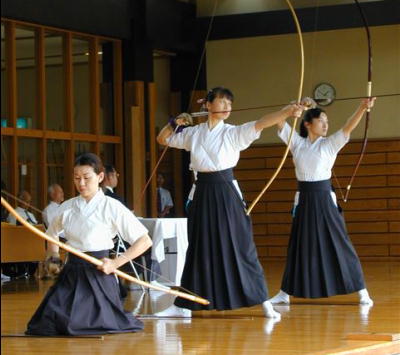
In order to click on windows in this screenshot , I will do `click(30, 85)`, `click(31, 157)`, `click(51, 102)`, `click(56, 155)`, `click(5, 98)`, `click(0, 155)`, `click(82, 65)`, `click(83, 149)`, `click(106, 103)`, `click(108, 149)`.